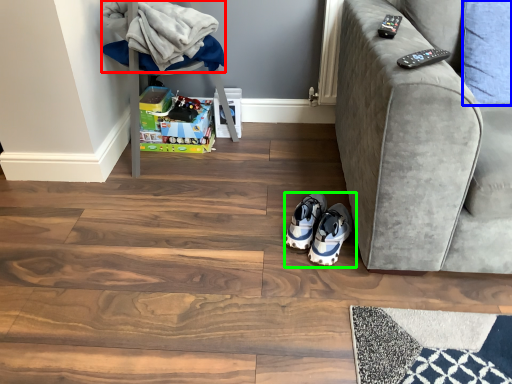
Question: Which object is the closest to the blanket (highlighted by a red box)? Choose among these: pillow (highlighted by a blue box) or footwear (highlighted by a green box).

Choices:
 (A) pillow
 (B) footwear

Answer: (B)